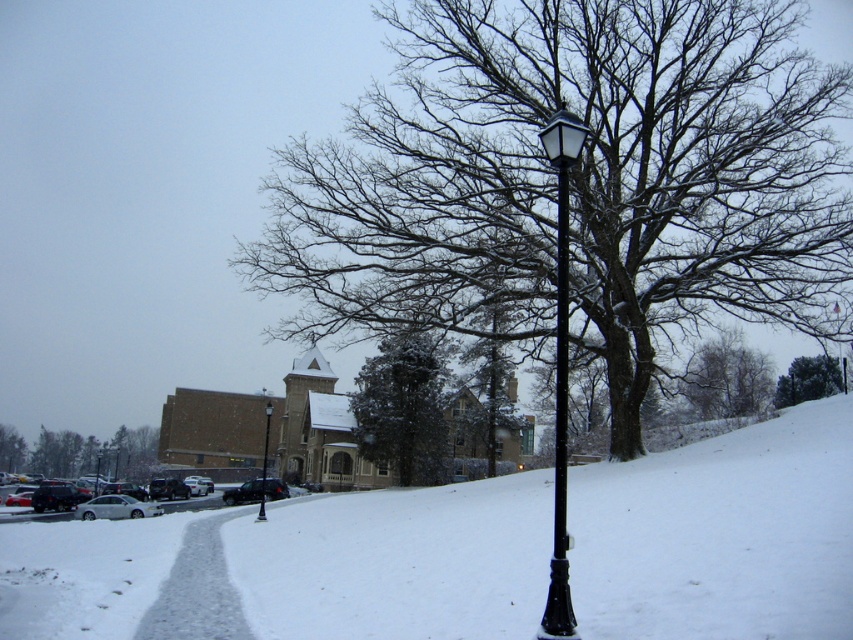
You are standing at the base of the black lamppost on the right side of the snow scene. You want to walk to the point marked by point (270,499). Is the point marked by point (776,65) closer to you than the point you want to reach?

Yes, the point marked by point (776,65) is closer to you than the point marked by point (270,499).